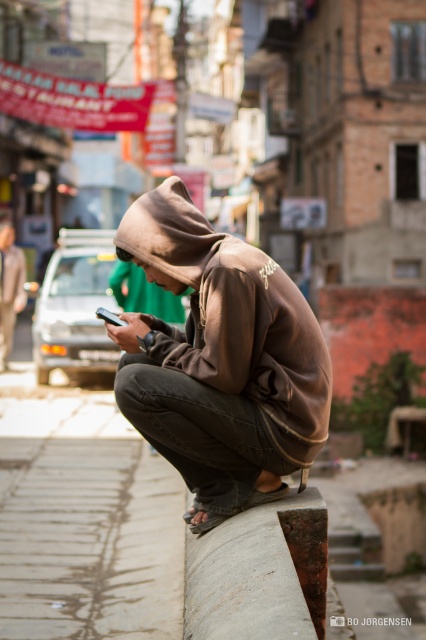
You are a delivery drone operator. Your drone is currently at coordinates 0.5, 0.5 and needs to deliver a package to the brown matte hoodie at center. Which direction should the drone move to reach the target?

The brown matte hoodie at center is located at coordinates (x=219, y=360). Since the drone is at (x=213, y=320), it should move northeast to reach the target.

You are a delivery robot with a height of 1 meter. You are positioned at the rusty metal curb at lower center and need to deliver a package to the brown matte hoodie at center. Can you reach the recipient without moving? Please explain your reasoning.

The distance between the brown matte hoodie at center and the rusty metal curb at lower center is 69.70 centimeters. Since the robot is 1 meter tall, it can likely see and reach the recipient as the distance is within its operational range, assuming no obstacles block the path.

You are standing on the street and see a person crouching on a low wall or ledge, engrossed in their smartphone. The coordinates of the point where the person is located are point (261,556). If you want to approach them without getting too close, what is the minimum distance you should maintain?

The point (261,556) is 4.39 meters away from the viewer. To approach without getting too close, you should maintain a minimum distance of 4.39 meters.